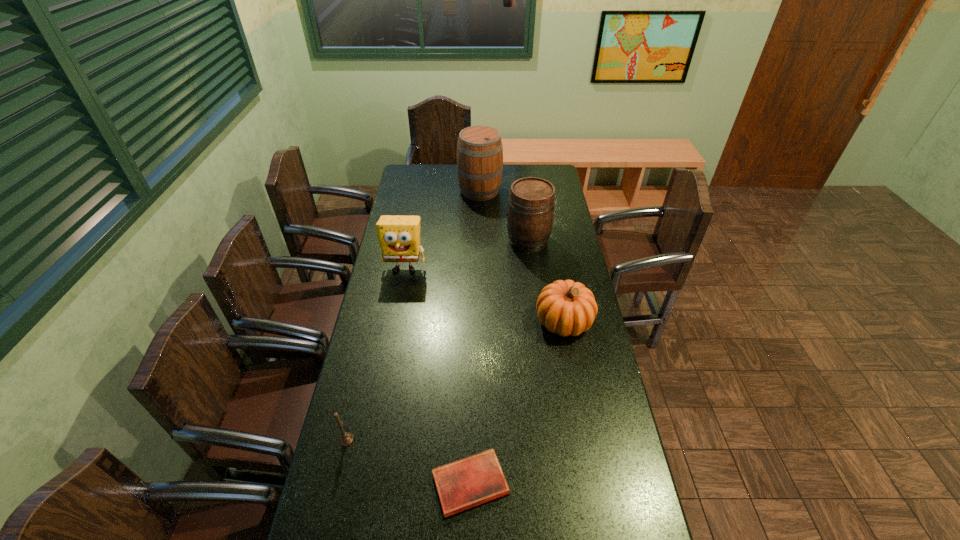
The height and width of the screenshot is (540, 960). In order to click on blank region between the right cider and the nearest object in this screenshot , I will do `click(499, 362)`.

Image resolution: width=960 pixels, height=540 pixels. Identify the location of free space between the fourth nearest object and the left cider. (443, 229).

The image size is (960, 540). I want to click on vacant area that lies between the farthest object and the fifth nearest object, so click(x=504, y=215).

Where is `free space that is in between the left cider and the sponge`? free space that is in between the left cider and the sponge is located at coordinates (443, 229).

What are the coordinates of `vacant point located between the fourth nearest object and the fifth nearest object` in the screenshot? It's located at (467, 254).

I want to click on free space between the candle and the fifth nearest object, so click(437, 340).

Identify the location of empty location between the third farthest object and the fifth tallest object. (375, 354).

This screenshot has height=540, width=960. I want to click on vacant point located between the second nearest object and the nearest object, so click(x=408, y=461).

Locate which object is the third closest to the fourth tallest object. Please provide its 2D coordinates. Your answer should be formatted as a tuple, i.e. [(x, y)], where the tuple contains the x and y coordinates of a point satisfying the conditions above.

[(399, 236)]

Identify which object is the fifth closest to the second nearest object. Please provide its 2D coordinates. Your answer should be formatted as a tuple, i.e. [(x, y)], where the tuple contains the x and y coordinates of a point satisfying the conditions above.

[(479, 148)]